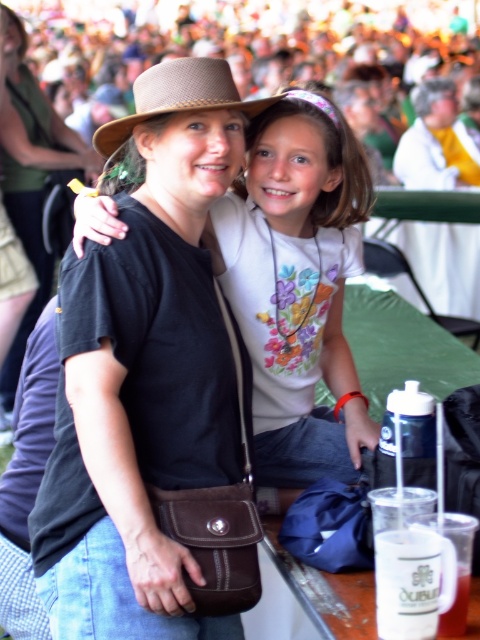
Question: Which point appears farthest from the camera in this image?

Choices:
 (A) (336, 116)
 (B) (0, 132)
 (C) (162, 106)

Answer: (B)

Question: Which of these objects is positioned closest to the matte brown hat at center?

Choices:
 (A) brown woven cowboy hat at center
 (B) matte black shirt at center

Answer: (A)

Question: Among these objects, which one is nearest to the camera?

Choices:
 (A) matte brown hat at center
 (B) brown woven cowboy hat at center

Answer: (B)

Question: Considering the relative positions of matte brown hat at center and brown woven cowboy hat at center in the image provided, where is matte brown hat at center located with respect to brown woven cowboy hat at center?

Choices:
 (A) left
 (B) right

Answer: (B)

Question: Can you confirm if matte black shirt at center is bigger than brown woven cowboy hat at center?

Choices:
 (A) yes
 (B) no

Answer: (A)

Question: From the image, what is the correct spatial relationship of matte brown hat at center in relation to matte black shirt at center?

Choices:
 (A) left
 (B) right

Answer: (B)